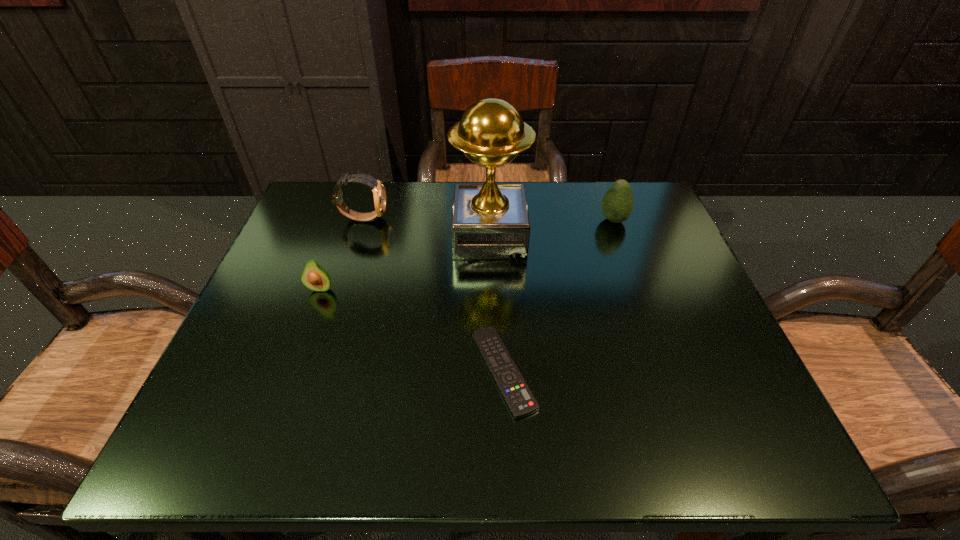
Identify the location of blank area located 0.350m on the front-facing side of the award. (301, 235).

Find the location of `free space located 0.200m on the face of the watch`. free space located 0.200m on the face of the watch is located at coordinates pos(469,218).

Identify the location of vacant point located 0.330m on the left of the farther avocado. This screenshot has width=960, height=540. (463, 220).

Find the location of `free location located on the cut side of the left avocado`. free location located on the cut side of the left avocado is located at coordinates (292, 366).

Locate an element on the screen. vacant position located on the left of the nearest object is located at coordinates (368, 371).

Find the location of a particular element. award that is at the far edge is located at coordinates (489, 221).

In order to click on watch located at the far edge in this screenshot , I will do `click(379, 194)`.

You are a GUI agent. You are given a task and a screenshot of the screen. Output one action in this format:
    pyautogui.click(x=<x>, y=<y>)
    Task: Click on the avocado situated at the far edge
    The image size is (960, 540).
    Given the screenshot: What is the action you would take?
    pyautogui.click(x=617, y=204)

Identify the location of object situated at the near edge. (515, 391).

Where is `watch located at the left edge`? The height and width of the screenshot is (540, 960). watch located at the left edge is located at coordinates (379, 194).